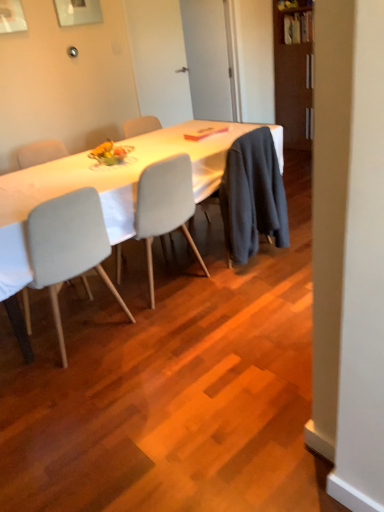
Describe the element at coordinates (103, 188) in the screenshot. This screenshot has height=512, width=384. I see `white fabric table at center` at that location.

Measure the distance between matte white plate at center and camera.

The depth of matte white plate at center is 8.59 feet.

What do you see at coordinates (294, 72) in the screenshot? This screenshot has height=512, width=384. I see `brown wooden bookshelf at upper right` at bounding box center [294, 72].

You are a GUI agent. You are given a task and a screenshot of the screen. Output one action in this format:
    pyautogui.click(x=<x>, y=<y>)
    Task: Click on the dark gray fabric robe at center
    This screenshot has width=384, height=512.
    Given the screenshot: What is the action you would take?
    pyautogui.click(x=252, y=196)

What is the approximate width of light gray fabric chair at center, which is the first chair in left-to-right order?

23.14 inches.

Measure the distance between light gray fabric chair at center, which is the first chair in left-to-right order, and camera.

A distance of 1.86 meters exists between light gray fabric chair at center, which is the first chair in left-to-right order, and camera.

Locate an element on the screen. The image size is (384, 512). white fabric table at center is located at coordinates (103, 188).

From a real-world perspective, is light gray fabric chair at center, which ranks as the 1th chair in right-to-left order, beneath matte white plate at center?

Yes, from a real-world perspective, light gray fabric chair at center, which ranks as the 1th chair in right-to-left order, is below matte white plate at center.

How many degrees apart are the facing directions of light gray fabric chair at center, which ranks as the 1th chair in right-to-left order, and matte white plate at center?

The angle between the facing direction of light gray fabric chair at center, which ranks as the 1th chair in right-to-left order, and the facing direction of matte white plate at center is 85.2 degrees.

From the image's perspective, between light gray fabric chair at center, which ranks as the 1th chair in right-to-left order, and matte white plate at center, who is located below?

light gray fabric chair at center, which ranks as the 1th chair in right-to-left order, appears lower in the image.

Looking at this image, in the image, is pink matte book at center positioned in front of or behind light gray fabric chair at center, which ranks as the 2th chair in right-to-left order?

Clearly, pink matte book at center is behind light gray fabric chair at center, which ranks as the 2th chair in right-to-left order.

Would you say pink matte book at center is a long distance from light gray fabric chair at center, which ranks as the 2th chair in right-to-left order?

pink matte book at center is far away from light gray fabric chair at center, which ranks as the 2th chair in right-to-left order.

Could you tell me if pink matte book at center is facing light gray fabric chair at center, which ranks as the 2th chair in right-to-left order?

No, pink matte book at center is not turned towards light gray fabric chair at center, which ranks as the 2th chair in right-to-left order.

Is pink matte book at center positioned beyond the bounds of light gray fabric chair at center, which ranks as the 2th chair in right-to-left order?

Yes, pink matte book at center is outside of light gray fabric chair at center, which ranks as the 2th chair in right-to-left order.

Is point (253, 192) closer to viewer compared to point (289, 76)?

Yes, it is in front of point (289, 76).

Is dark gray fabric robe at center taller or shorter than brown wooden bookshelf at upper right?

dark gray fabric robe at center is shorter than brown wooden bookshelf at upper right.

Which object is thinner, dark gray fabric robe at center or brown wooden bookshelf at upper right?

dark gray fabric robe at center.

Which object is positioned more to the right, metallic silver picture frame at upper center or brown wooden bookshelf at upper right?

brown wooden bookshelf at upper right is more to the right.

From a real-world perspective, who is located higher, metallic silver picture frame at upper center or brown wooden bookshelf at upper right?

metallic silver picture frame at upper center is physically above.

Is metallic silver picture frame at upper center bigger than pink matte book at center?

Yes.

From the image's perspective, between metallic silver picture frame at upper center and pink matte book at center, who is located below?

From the image's view, pink matte book at center is below.

Who is shorter, metallic silver picture frame at upper center or pink matte book at center?

With less height is pink matte book at center.

You are a GUI agent. You are given a task and a screenshot of the screen. Output one action in this format:
    pyautogui.click(x=<x>, y=<y>)
    Task: Click on the picture frame located above the pink matte book at center (from the image's perspective)
    This screenshot has width=384, height=512.
    Given the screenshot: What is the action you would take?
    pyautogui.click(x=78, y=12)

Considering the positions of objects brown wooden bookshelf at upper right and metallic silver picture frame at upper center in the image provided, who is more to the right, brown wooden bookshelf at upper right or metallic silver picture frame at upper center?

From the viewer's perspective, brown wooden bookshelf at upper right appears more on the right side.

From a real-world perspective, between brown wooden bookshelf at upper right and metallic silver picture frame at upper center, who is vertically higher?

In real-world perspective, metallic silver picture frame at upper center is above.

Is the depth of brown wooden bookshelf at upper right greater than that of metallic silver picture frame at upper center?

Yes, it is behind metallic silver picture frame at upper center.

Are pink matte book at center and light gray fabric chair at center, which ranks as the 2th chair in left-to-right order, located far from each other?

No, there isn't a large distance between pink matte book at center and light gray fabric chair at center, which ranks as the 2th chair in left-to-right order.

From the image's perspective, who appears lower, pink matte book at center or light gray fabric chair at center, which ranks as the 1th chair in right-to-left order?

From the image's view, light gray fabric chair at center, which ranks as the 1th chair in right-to-left order, is below.

Is pink matte book at center facing towards light gray fabric chair at center, which ranks as the 2th chair in left-to-right order?

No, pink matte book at center is not aimed at light gray fabric chair at center, which ranks as the 2th chair in left-to-right order.

From the picture: How much distance is there between pink matte book at center and light gray fabric chair at center, which ranks as the 1th chair in right-to-left order?

pink matte book at center and light gray fabric chair at center, which ranks as the 1th chair in right-to-left order, are 29.10 inches apart from each other.

This screenshot has height=512, width=384. I want to click on chair that is the 1st object directly below the matte white plate at center (from a real-world perspective), so click(165, 207).

What are the coordinates of `book that appears above the light gray fabric chair at center, which ranks as the 2th chair in right-to-left order (from the image's perspective)` in the screenshot? It's located at (204, 133).

Looking at this image, based on their spatial positions, is light gray fabric chair at center, which is the first chair in left-to-right order, or brown wooden bookshelf at upper right further from dark gray fabric robe at center?

Among the two, brown wooden bookshelf at upper right is located further to dark gray fabric robe at center.

From the image, which object appears to be farther from matte white plate at center, light gray fabric chair at center, which is the first chair in left-to-right order, or white fabric table at center?

light gray fabric chair at center, which is the first chair in left-to-right order, is further to matte white plate at center.

When comparing their distances from white fabric table at center, does brown wooden bookshelf at upper right or light gray fabric chair at center, which ranks as the 2th chair in left-to-right order, seem further?

The object further to white fabric table at center is brown wooden bookshelf at upper right.

Looking at the image, which one is located further to white fabric table at center, dark gray fabric robe at center or light gray fabric chair at center, which is the first chair in left-to-right order?

light gray fabric chair at center, which is the first chair in left-to-right order, is positioned further to the anchor white fabric table at center.

Considering their positions, is pink matte book at center positioned further to dark gray fabric robe at center than matte white plate at center?

matte white plate at center is further to dark gray fabric robe at center.

Based on the photo, which object lies nearer to the anchor point matte white plate at center, metallic silver picture frame at upper center or white fabric table at center?

white fabric table at center is closer to matte white plate at center.

Looking at the image, which one is located further to metallic silver picture frame at upper center, white fabric table at center or brown wooden bookshelf at upper right?

Based on the image, brown wooden bookshelf at upper right appears to be further to metallic silver picture frame at upper center.

Considering their positions, is dark gray fabric robe at center positioned further to matte white plate at center than light gray fabric chair at center, which is the first chair in left-to-right order?

dark gray fabric robe at center lies further to matte white plate at center than the other object.

I want to click on plate between white fabric table at center and pink matte book at center along the z-axis, so click(110, 153).

Identify the location of book between metallic silver picture frame at upper center and dark gray fabric robe at center vertically. (204, 133).

The height and width of the screenshot is (512, 384). Identify the location of book between white fabric table at center and brown wooden bookshelf at upper right from front to back. (204, 133).

I want to click on robe between light gray fabric chair at center, which ranks as the 2th chair in left-to-right order, and pink matte book at center in the front-back direction, so click(252, 196).